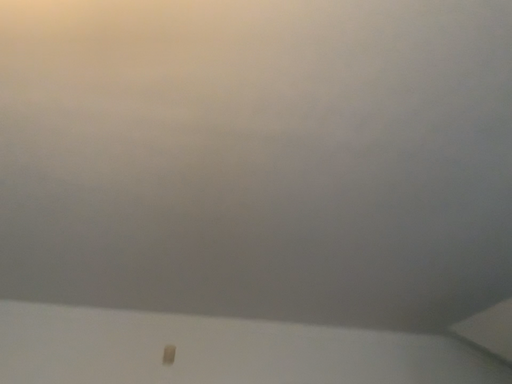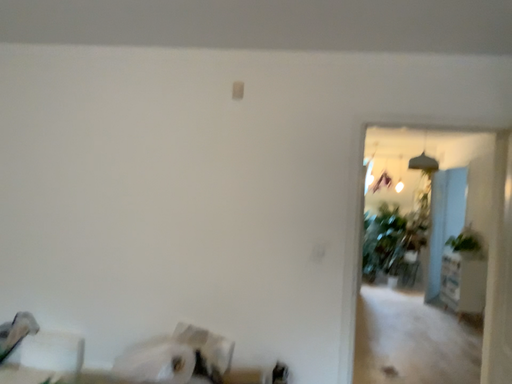
Question: How did the camera likely rotate when shooting the video?

Choices:
 (A) rotated right
 (B) rotated left

Answer: (B)